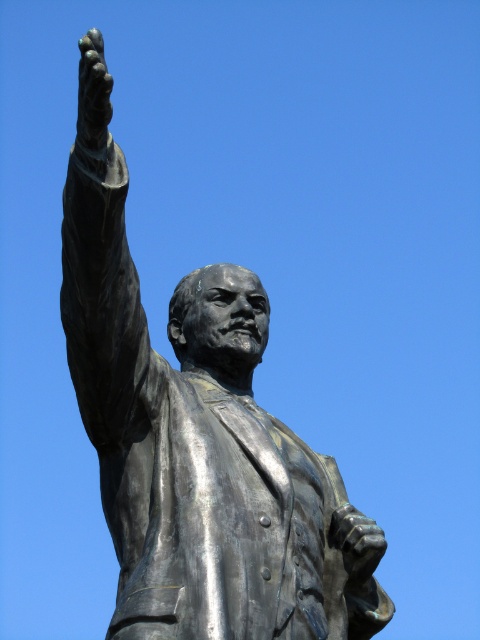
Between bronze statue at upper center and polished bronze hand at upper left, which one has more height?

With more height is polished bronze hand at upper left.

Does bronze statue at upper center have a larger size compared to polished bronze hand at upper left?

Actually, bronze statue at upper center might be smaller than polished bronze hand at upper left.

Is point (120, 378) farther from viewer compared to point (99, 106)?

Yes, point (120, 378) is behind point (99, 106).

I want to click on bronze statue at upper center, so click(201, 449).